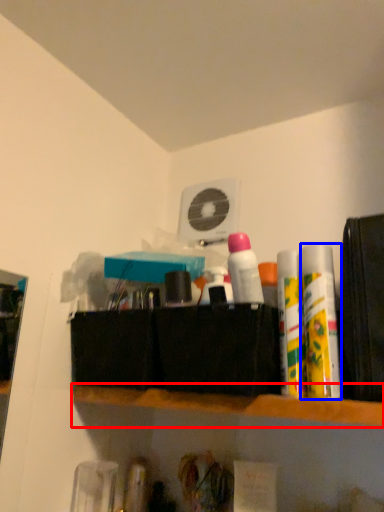
Question: Which object is further to the camera taking this photo, shelf (highlighted by a red box) or toiletry (highlighted by a blue box)?

Choices:
 (A) shelf
 (B) toiletry

Answer: (B)